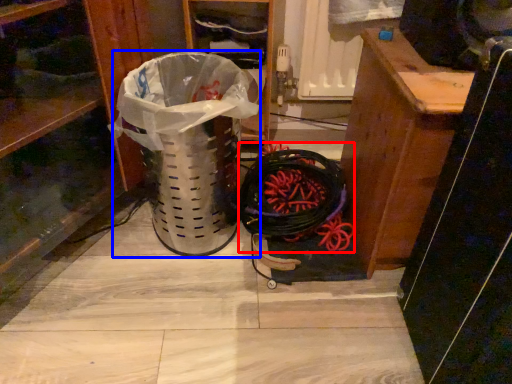
Question: Which of the following is the closest to the observer, battle rope (highlighted by a red box) or garbage (highlighted by a blue box)?

Choices:
 (A) battle rope
 (B) garbage

Answer: (B)